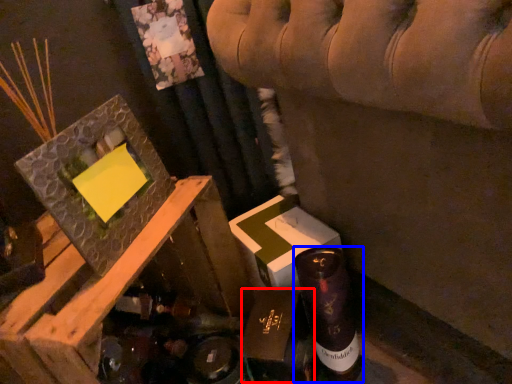
Question: Among these objects, which one is nearest to the camera, cardboard box (highlighted by a red box) or bottle (highlighted by a blue box)?

Choices:
 (A) cardboard box
 (B) bottle

Answer: (A)